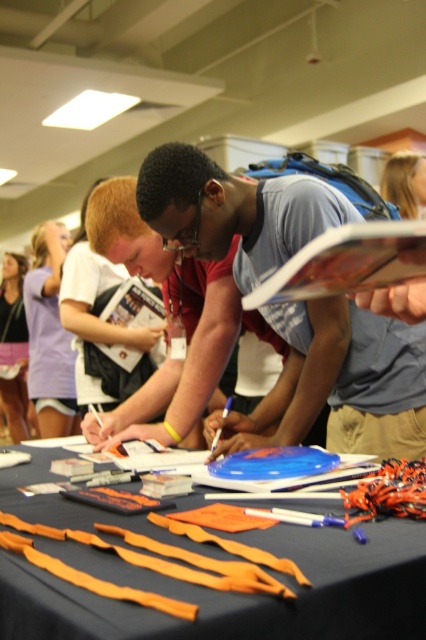
Does point (213, 196) come behind point (416, 540)?

Yes, point (213, 196) is behind point (416, 540).

Where is `matte blue shirt at center`? This screenshot has height=640, width=426. matte blue shirt at center is located at coordinates (339, 381).